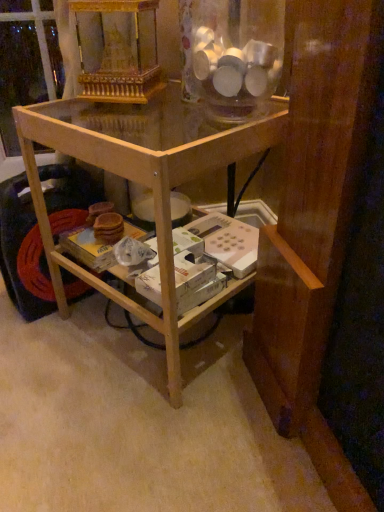
Question: From a real-world perspective, is transparent glass jar at upper center positioned above or below light brown wood table at center?

Choices:
 (A) below
 (B) above

Answer: (B)

Question: Which is correct: transparent glass jar at upper center is inside light brown wood table at center, or outside of it?

Choices:
 (A) outside
 (B) inside

Answer: (A)

Question: Based on their positions, is transparent glass jar at upper center located to the left or right of light brown wood table at center?

Choices:
 (A) right
 (B) left

Answer: (A)

Question: Do you think light brown wood table at center is within transparent glass jar at upper center, or outside of it?

Choices:
 (A) outside
 (B) inside

Answer: (A)

Question: Considering the positions of light brown wood table at center and transparent glass jar at upper center in the image, is light brown wood table at center bigger or smaller than transparent glass jar at upper center?

Choices:
 (A) big
 (B) small

Answer: (A)

Question: Considering the positions of point (142, 175) and point (201, 49), is point (142, 175) closer or farther from the camera than point (201, 49)?

Choices:
 (A) farther
 (B) closer

Answer: (B)

Question: In the image, is light brown wood table at center on the left side or the right side of transparent glass jar at upper center?

Choices:
 (A) right
 (B) left

Answer: (B)